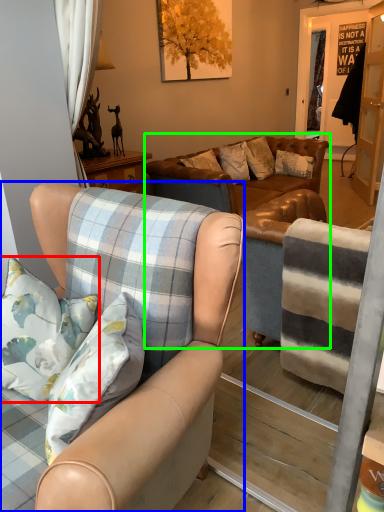
Question: Based on their relative distances, which object is nearer to pillow (highlighted by a red box)? Choose from chair (highlighted by a blue box) and studio couch (highlighted by a green box).

Choices:
 (A) chair
 (B) studio couch

Answer: (A)